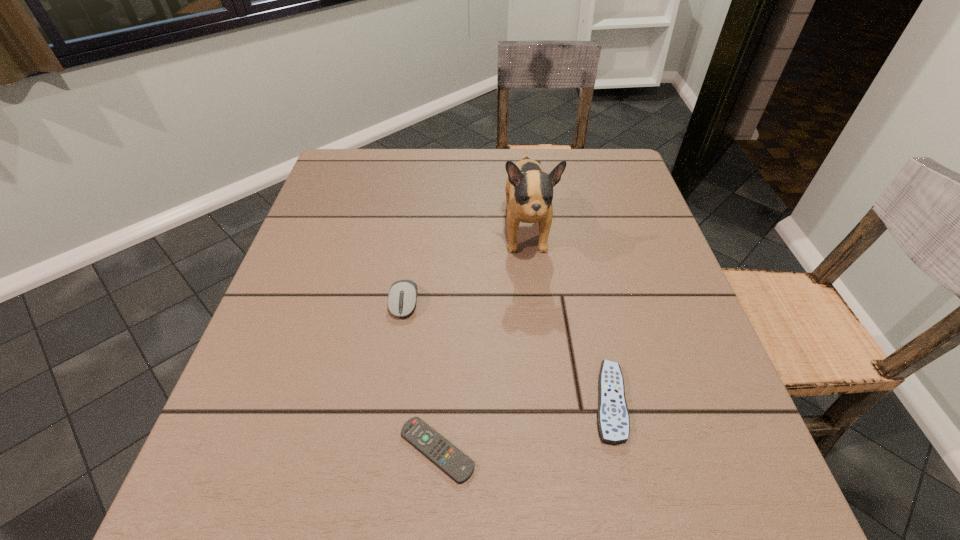
Where is `the farthest object`? This screenshot has height=540, width=960. the farthest object is located at coordinates (529, 190).

I want to click on the tallest object, so click(x=529, y=190).

Where is `the second tallest object`? The height and width of the screenshot is (540, 960). the second tallest object is located at coordinates 402,298.

The width and height of the screenshot is (960, 540). In order to click on computer equipment in this screenshot , I will do `click(402, 298)`.

Image resolution: width=960 pixels, height=540 pixels. Identify the location of the taller remote control. (613, 420).

Where is `the right remote control`? Image resolution: width=960 pixels, height=540 pixels. the right remote control is located at coordinates (613, 420).

The width and height of the screenshot is (960, 540). What are the coordinates of `the shortest object` in the screenshot? It's located at (457, 465).

This screenshot has height=540, width=960. In order to click on the shorter remote control in this screenshot , I will do `click(457, 465)`.

I want to click on free space located at the face of the farthest object, so click(x=544, y=402).

You are a GUI agent. You are given a task and a screenshot of the screen. Output one action in this format:
    pyautogui.click(x=<x>, y=<y>)
    Task: Click on the free region located on the wheel side of the third nearest object
    
    Given the screenshot: What is the action you would take?
    pyautogui.click(x=398, y=342)